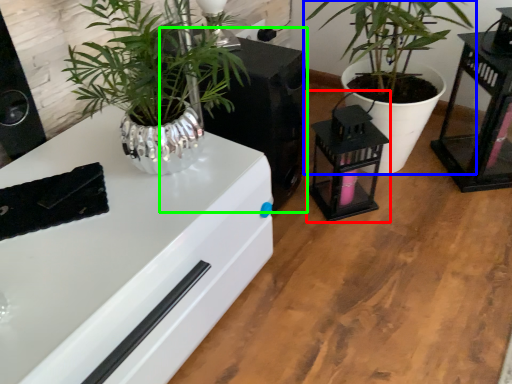
Question: Which object is the closest to the appliance (highlighted by a red box)? Choose among these: houseplant (highlighted by a blue box) or appliance (highlighted by a green box).

Choices:
 (A) houseplant
 (B) appliance

Answer: (B)